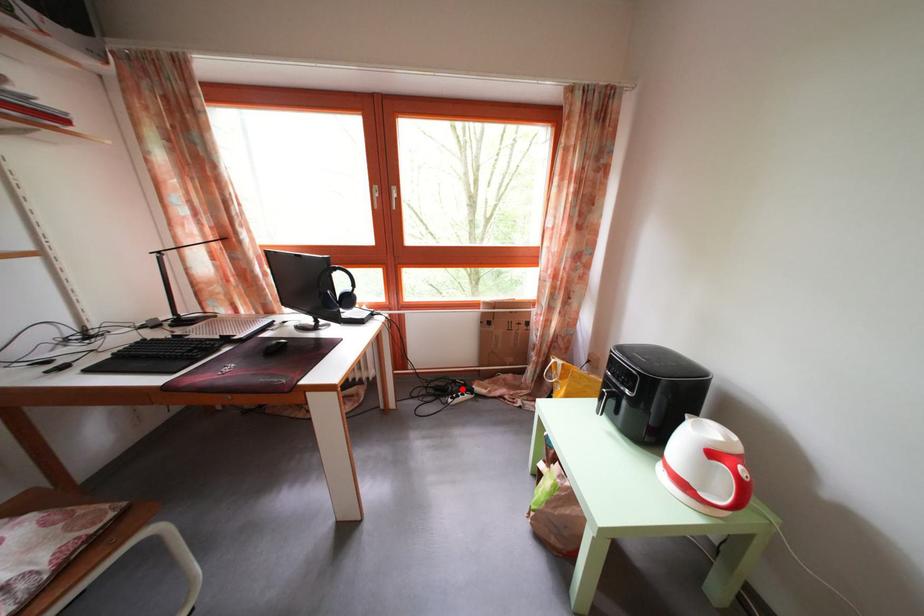
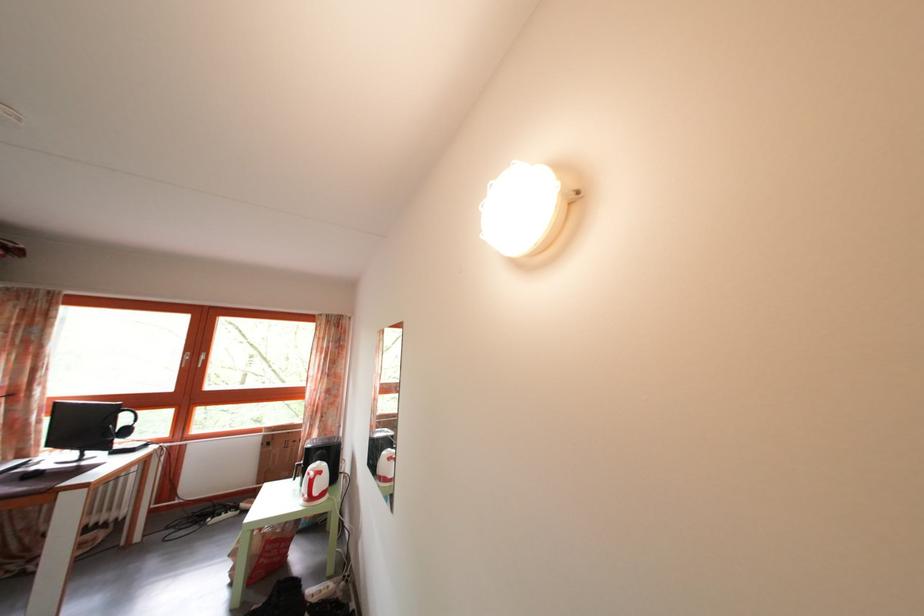
In the second image, find the point that corresponds to the highlighted location in the first image.

(233, 514)